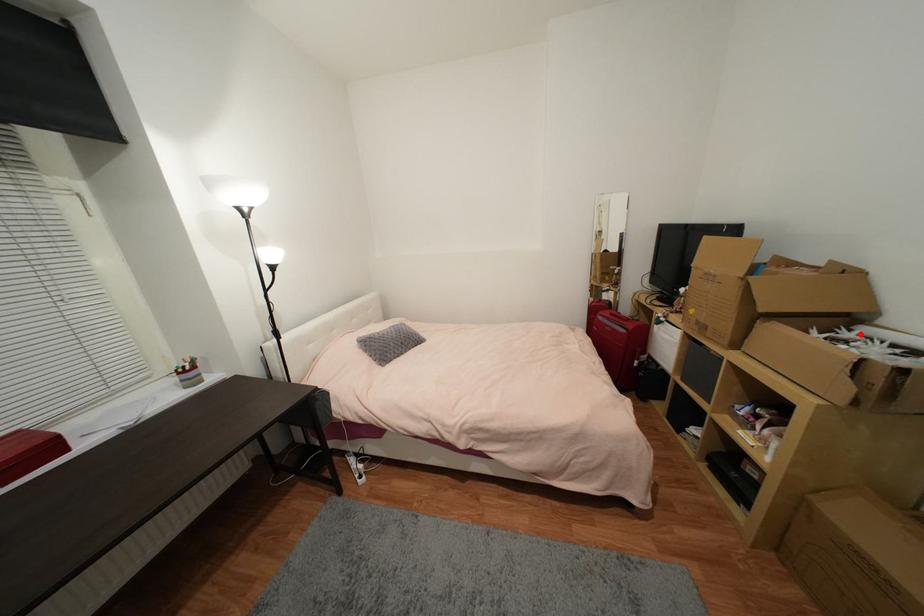
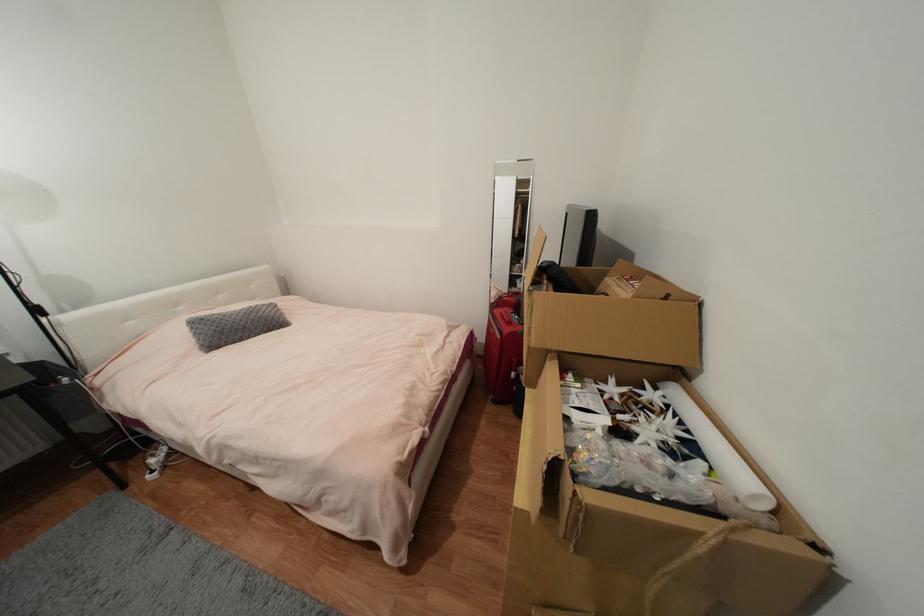
Question: I am providing you with two images of the same scene from different viewpoints. Given a red point in image1, look at the same physical point in image2. Is it:

Choices:
 (A) Closer to the viewpoint
 (B) Farther from the viewpoint

Answer: (A)